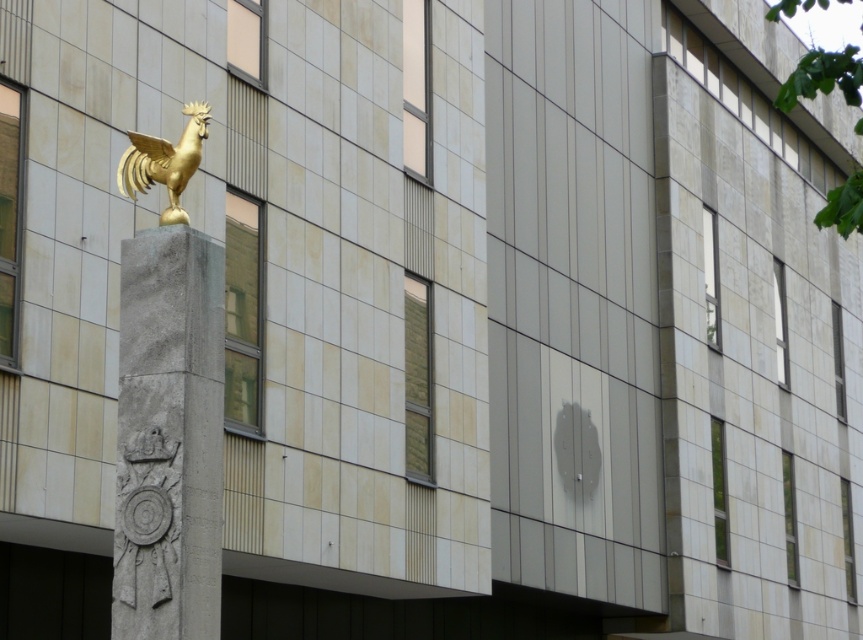
Question: Is gray stone column at center smaller than gold metallic rooster at upper left?

Choices:
 (A) yes
 (B) no

Answer: (B)

Question: Which point appears farthest from the camera in this image?

Choices:
 (A) (147, 182)
 (B) (124, 314)

Answer: (A)

Question: In this image, where is gray stone column at center located relative to gold metallic rooster at upper left?

Choices:
 (A) above
 (B) below

Answer: (B)

Question: Which of the following is the closest to the observer?

Choices:
 (A) (145, 173)
 (B) (118, 611)

Answer: (B)

Question: Which object appears farthest from the camera in this image?

Choices:
 (A) gold metallic rooster at upper left
 (B) gray stone column at center

Answer: (A)

Question: From the image, what is the correct spatial relationship of gray stone column at center in relation to gold metallic rooster at upper left?

Choices:
 (A) right
 (B) left

Answer: (A)